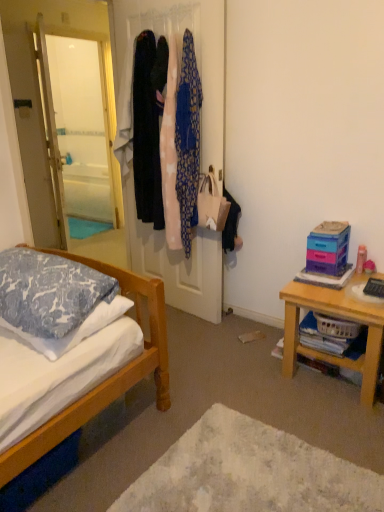
At what (x,y) coordinates should I click in order to perform the action: click on free space in front of wooden table at right. Please return your answer as a coordinate pair (x, y). The height and width of the screenshot is (512, 384). Looking at the image, I should click on (331, 420).